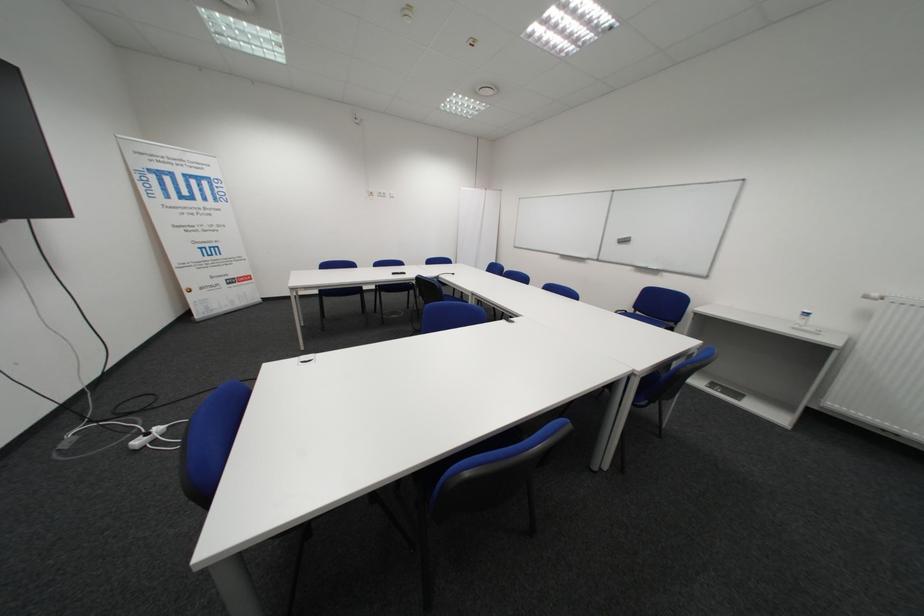
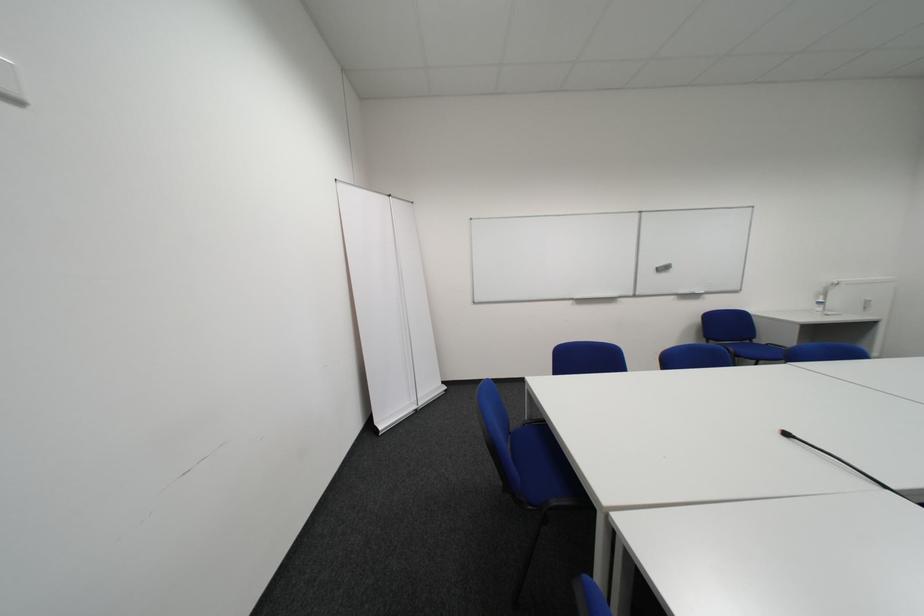
Find the pixel in the second image that matches pixel 629 241 in the first image.

(669, 270)